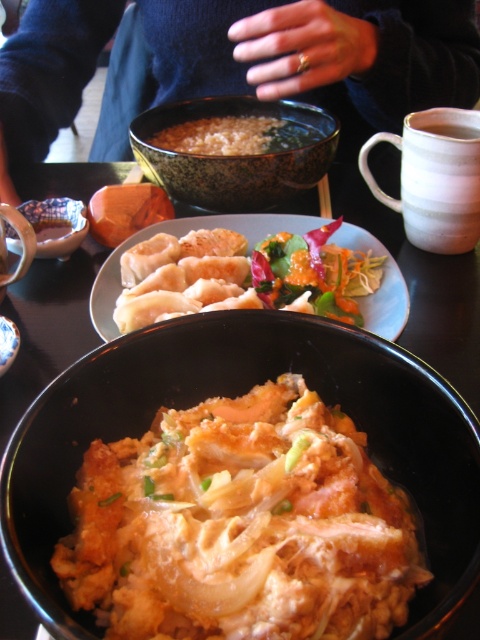
Question: Which object appears farthest from the camera in this image?

Choices:
 (A) shiny brown bowl at center
 (B) golden brown dumplings at center
 (C) brown matte rice at center
 (D) porcelain bowl at lower left

Answer: (C)

Question: Is shiny brown bowl at center thinner than brown matte rice at center?

Choices:
 (A) yes
 (B) no

Answer: (B)

Question: Which point is closer to the camera?

Choices:
 (A) (363, 22)
 (B) (242, 140)
 (C) (252, 268)

Answer: (C)

Question: Where is golden fried rice at center located in relation to porcelain bowl at lower left in the image?

Choices:
 (A) left
 (B) right

Answer: (B)

Question: Among these objects, which one is nearest to the camera?

Choices:
 (A) shiny brown bowl at center
 (B) dark blue sweater at upper center
 (C) brown matte rice at center
 (D) shiny orange salad at center

Answer: (D)

Question: Is golden fried rice at center to the right of golden brown dumplings at center from the viewer's perspective?

Choices:
 (A) yes
 (B) no

Answer: (B)